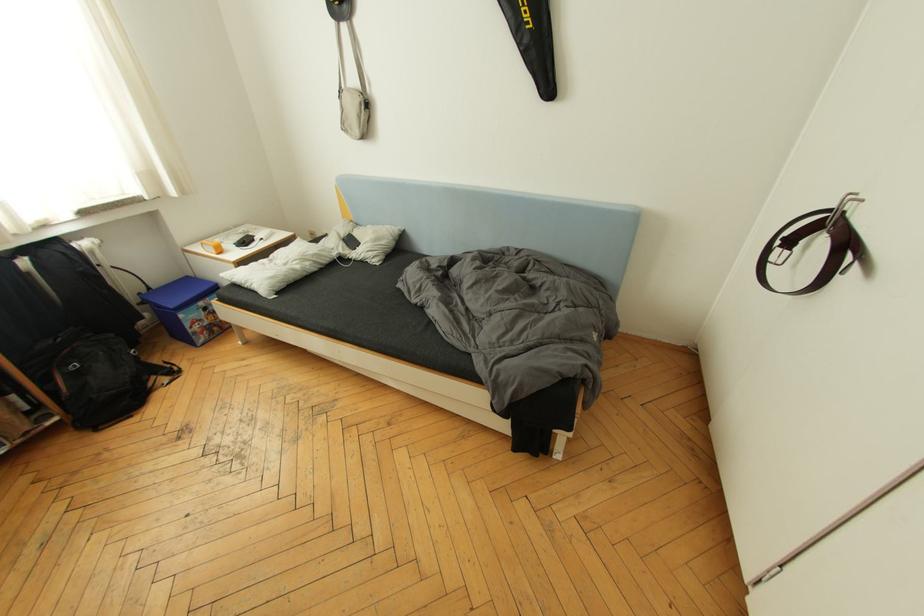
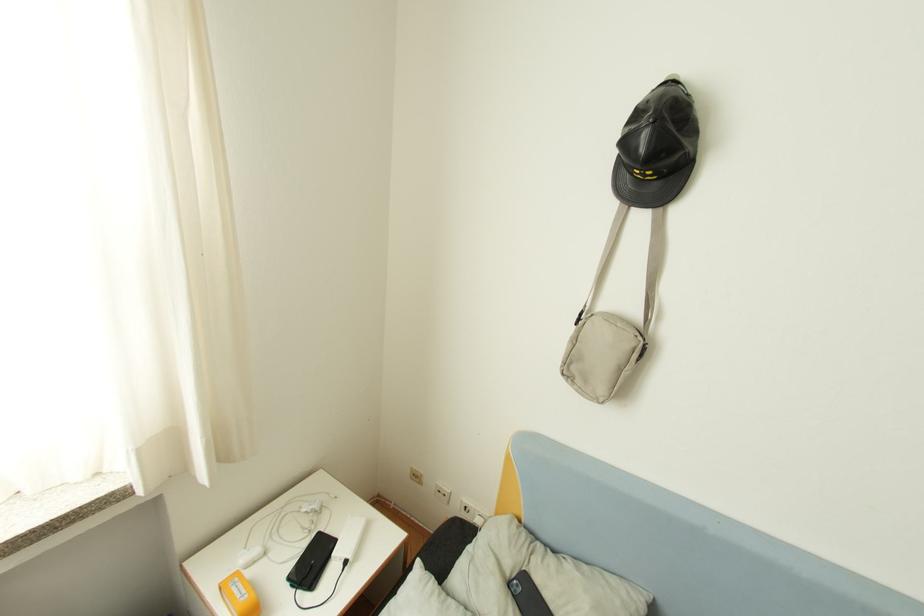
What movement of the cameraman would produce the second image?

The cameraman walked toward left, forward.